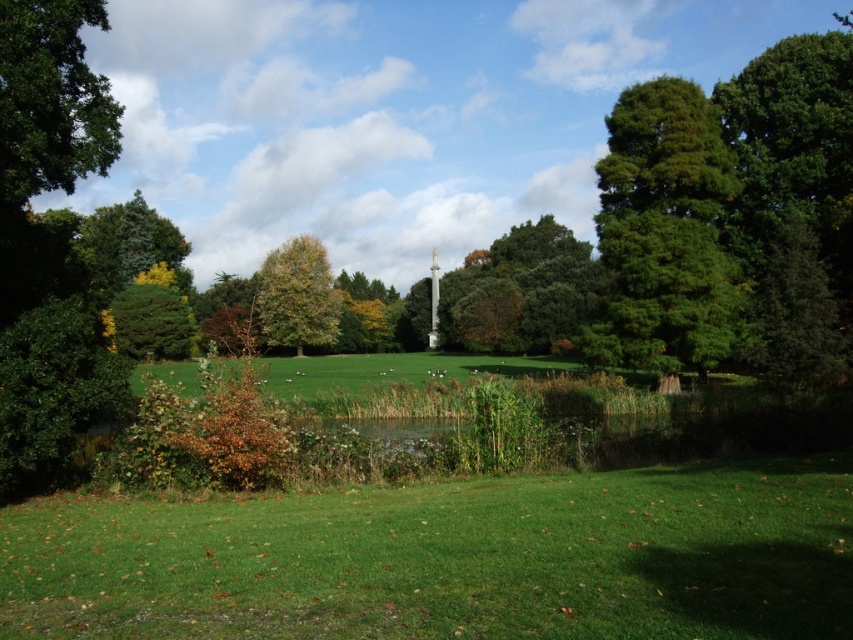
Question: Considering the real-world distances, which object is farthest from the green leafy tree at upper left?

Choices:
 (A) green leafy tree at center
 (B) green glossy tree at right
 (C) green grassy field at lower center

Answer: (A)

Question: Does green leafy tree at upper left come in front of green leafy tree at center?

Choices:
 (A) no
 (B) yes

Answer: (B)

Question: Which point appears farthest from the camera in this image?

Choices:
 (A) (706, 134)
 (B) (838, 550)

Answer: (A)

Question: Can you confirm if green leafy tree at upper left is positioned to the right of green leafy tree at center?

Choices:
 (A) yes
 (B) no

Answer: (A)

Question: Is the position of green glossy tree at right more distant than that of green leafy tree at center?

Choices:
 (A) yes
 (B) no

Answer: (B)

Question: Which object is positioned farthest from the green grassy field at lower center?

Choices:
 (A) green leafy tree at upper left
 (B) green glossy tree at right
 (C) green leafy tree at center

Answer: (C)